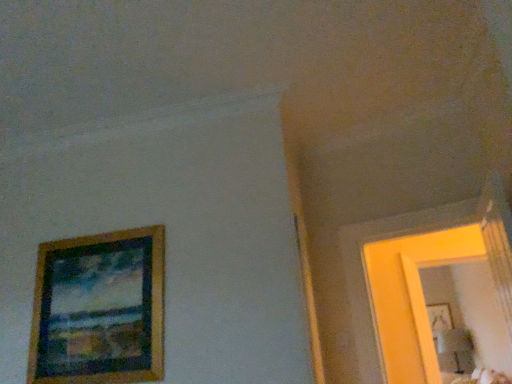
You are a GUI agent. You are given a task and a screenshot of the screen. Output one action in this format:
    pyautogui.click(x=<x>, y=<y>)
    Task: Click on the wooden picture frame at upper right, the first picture frame when ordered from right to left
    
    Given the screenshot: What is the action you would take?
    pyautogui.click(x=439, y=318)

This screenshot has height=384, width=512. Identify the location of wooden picture frame at upper right, the 1th picture frame from the back. (439, 318).

Does wooden picture frame at upper right, the first picture frame in the bottom-to-top sequence, turn towards wooden picture frame at left, the second picture frame viewed from the right?

No, wooden picture frame at upper right, the first picture frame in the bottom-to-top sequence, is not aimed at wooden picture frame at left, the second picture frame viewed from the right.

From a real-world perspective, is wooden picture frame at upper right, the first picture frame when ordered from right to left, above or below wooden picture frame at left, arranged as the first picture frame when viewed from the top?

Clearly, from a real-world perspective, wooden picture frame at upper right, the first picture frame when ordered from right to left, is above wooden picture frame at left, arranged as the first picture frame when viewed from the top.

Choose the correct answer: Is wooden picture frame at upper right, the 1th picture frame from the back, inside wooden picture frame at left, the first picture frame in the front-to-back sequence, or outside it?

wooden picture frame at upper right, the 1th picture frame from the back, is located beyond the bounds of wooden picture frame at left, the first picture frame in the front-to-back sequence.

Is matte yellow mirror at right outside of wooden picture frame at left, the second picture frame viewed from the right?

Indeed, matte yellow mirror at right is completely outside wooden picture frame at left, the second picture frame viewed from the right.

Which object is positioned more to the left, matte yellow mirror at right or wooden picture frame at left, which ranks as the 2th picture frame in back-to-front order?

From the viewer's perspective, wooden picture frame at left, which ranks as the 2th picture frame in back-to-front order, appears more on the left side.

From the image's perspective, would you say matte yellow mirror at right is positioned over wooden picture frame at left, the second picture frame viewed from the right?

Actually, matte yellow mirror at right appears below wooden picture frame at left, the second picture frame viewed from the right, in the image.

Considering the relative sizes of matte yellow mirror at right and wooden picture frame at left, the first picture frame in the front-to-back sequence, in the image provided, is matte yellow mirror at right wider than wooden picture frame at left, the first picture frame in the front-to-back sequence,?

Yes, matte yellow mirror at right is wider than wooden picture frame at left, the first picture frame in the front-to-back sequence.

Is wooden picture frame at left, which ranks as the 2th picture frame in back-to-front order, in front of or behind matte yellow mirror at right in the image?

In the image, wooden picture frame at left, which ranks as the 2th picture frame in back-to-front order, appears in front of matte yellow mirror at right.

Who is smaller, wooden picture frame at left, the second picture frame viewed from the right, or matte yellow mirror at right?

wooden picture frame at left, the second picture frame viewed from the right.

Based on their positions, is wooden picture frame at left, arranged as the first picture frame when viewed from the top, located to the left or right of matte yellow mirror at right?

From the image, it's evident that wooden picture frame at left, arranged as the first picture frame when viewed from the top, is to the left of matte yellow mirror at right.

Can you confirm if wooden picture frame at upper right, which is the second picture frame in front-to-back order, is thinner than matte yellow mirror at right?

Yes.

Looking at this image, from a real-world perspective, which is physically above, wooden picture frame at upper right, the first picture frame when ordered from right to left, or matte yellow mirror at right?

wooden picture frame at upper right, the first picture frame when ordered from right to left, is physically above.

Is wooden picture frame at upper right, the first picture frame in the bottom-to-top sequence, next to matte yellow mirror at right and touching it?

No, wooden picture frame at upper right, the first picture frame in the bottom-to-top sequence, is not next to matte yellow mirror at right.

Considering the relative positions of wooden picture frame at upper right, the second picture frame in the left-to-right sequence, and matte yellow mirror at right in the image provided, is wooden picture frame at upper right, the second picture frame in the left-to-right sequence, to the left or to the right of matte yellow mirror at right?

Based on their positions, wooden picture frame at upper right, the second picture frame in the left-to-right sequence, is located to the right of matte yellow mirror at right.

Does matte yellow mirror at right contain wooden picture frame at upper right, the 1th picture frame from the back?

No, wooden picture frame at upper right, the 1th picture frame from the back, is not surrounded by matte yellow mirror at right.

Identify the location of mirror that appears in front of the wooden picture frame at upper right, the first picture frame when ordered from right to left. The width and height of the screenshot is (512, 384). (472, 310).

Which object is wider, matte yellow mirror at right or wooden picture frame at upper right, acting as the 2th picture frame starting from the top?

matte yellow mirror at right.

Find the location of a particular element. picture frame that appears in front of the wooden picture frame at upper right, the first picture frame in the bottom-to-top sequence is located at coordinates (99, 309).

Is wooden picture frame at left, the first picture frame in the front-to-back sequence, taller than wooden picture frame at upper right, the first picture frame in the bottom-to-top sequence?

Correct, wooden picture frame at left, the first picture frame in the front-to-back sequence, is much taller as wooden picture frame at upper right, the first picture frame in the bottom-to-top sequence.

From the image's perspective, relative to wooden picture frame at upper right, the 1th picture frame from the back, is wooden picture frame at left, which ranks as the 2th picture frame in back-to-front order, above or below?

Based on their image positions, wooden picture frame at left, which ranks as the 2th picture frame in back-to-front order, is located above wooden picture frame at upper right, the 1th picture frame from the back.

From a real-world perspective, is wooden picture frame at left, which ranks as the 2th picture frame in back-to-front order, located beneath wooden picture frame at upper right, the 1th picture frame from the back?

Yes, from a real-world perspective, wooden picture frame at left, which ranks as the 2th picture frame in back-to-front order, is under wooden picture frame at upper right, the 1th picture frame from the back.

The height and width of the screenshot is (384, 512). Find the location of `picture frame that is on the right side of wooden picture frame at left, the first picture frame in the front-to-back sequence`. picture frame that is on the right side of wooden picture frame at left, the first picture frame in the front-to-back sequence is located at coordinates (439, 318).

Where is `picture frame that is the 1st one above the matte yellow mirror at right (from a real-world perspective)`? picture frame that is the 1st one above the matte yellow mirror at right (from a real-world perspective) is located at coordinates (99, 309).

When comparing their distances from wooden picture frame at upper right, the first picture frame when ordered from right to left, does matte yellow mirror at right or wooden picture frame at left, marked as the 1th picture frame in a left-to-right arrangement, seem further?

wooden picture frame at left, marked as the 1th picture frame in a left-to-right arrangement, is positioned further to the anchor wooden picture frame at upper right, the first picture frame when ordered from right to left.

Based on their spatial positions, is wooden picture frame at upper right, acting as the 2th picture frame starting from the top, or matte yellow mirror at right closer to wooden picture frame at left, arranged as the first picture frame when viewed from the top?

Among the two, matte yellow mirror at right is located nearer to wooden picture frame at left, arranged as the first picture frame when viewed from the top.

Looking at the image, which one is located closer to matte yellow mirror at right, wooden picture frame at left, which ranks as the 2th picture frame in back-to-front order, or wooden picture frame at upper right, acting as the 2th picture frame starting from the top?

wooden picture frame at upper right, acting as the 2th picture frame starting from the top, is positioned closer to the anchor matte yellow mirror at right.

Which object lies further to the anchor point matte yellow mirror at right, wooden picture frame at upper right, the first picture frame in the bottom-to-top sequence, or wooden picture frame at left, arranged as the first picture frame when viewed from the top?

wooden picture frame at left, arranged as the first picture frame when viewed from the top, lies further to matte yellow mirror at right than the other object.

Estimate the real-world distances between objects in this image. Which object is further from wooden picture frame at left, marked as the 1th picture frame in a left-to-right arrangement, matte yellow mirror at right or wooden picture frame at upper right, the second picture frame in the left-to-right sequence?

Among the two, wooden picture frame at upper right, the second picture frame in the left-to-right sequence, is located further to wooden picture frame at left, marked as the 1th picture frame in a left-to-right arrangement.

From the image, which object appears to be farther from wooden picture frame at upper right, the first picture frame in the bottom-to-top sequence, wooden picture frame at left, positioned as the 2th picture frame in bottom-to-top order, or matte yellow mirror at right?

Among the two, wooden picture frame at left, positioned as the 2th picture frame in bottom-to-top order, is located further to wooden picture frame at upper right, the first picture frame in the bottom-to-top sequence.

Image resolution: width=512 pixels, height=384 pixels. I want to click on mirror between wooden picture frame at left, the first picture frame in the front-to-back sequence, and wooden picture frame at upper right, the first picture frame in the bottom-to-top sequence, along the z-axis, so click(472, 310).